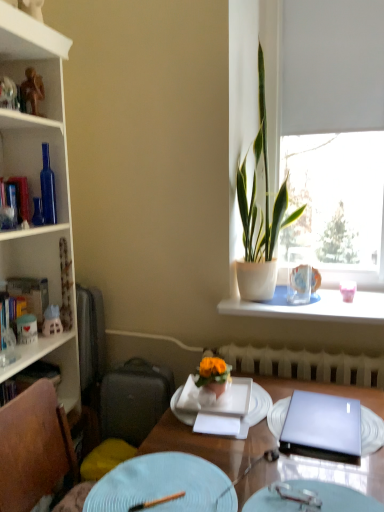
This screenshot has height=512, width=384. What are the coordinates of `vacant area that lies to the right of light blue ceramic plate at center, marked as the 2th plate in a front-to-back arrangement` in the screenshot? It's located at (289, 473).